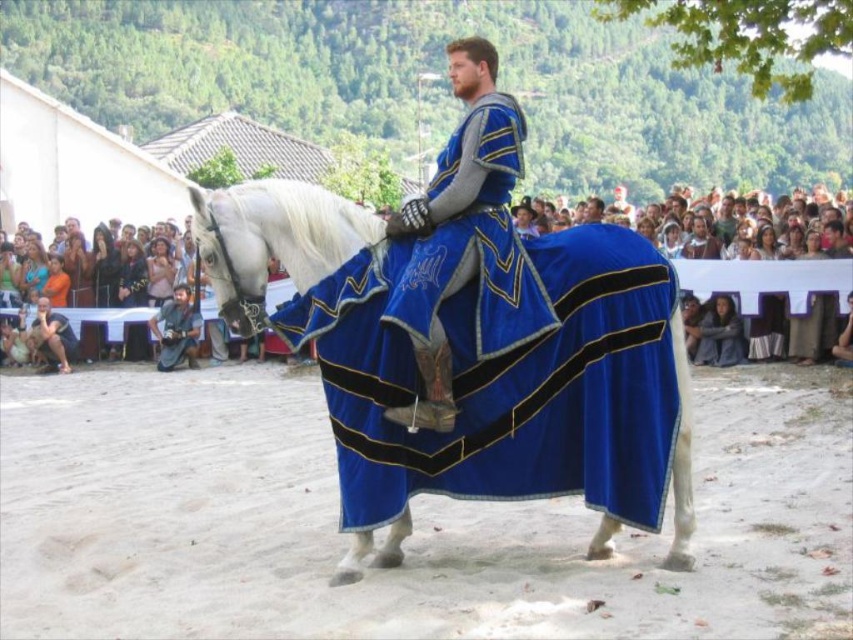
Based on the photo, you are a photographer at the medieval event. You want to capture both the blue velvet cape at center and the white glossy horse at center in a single frame. Given that your camera has a fixed focal length, which object should you position closer to the camera to ensure both fit in the frame?

Since the blue velvet cape at center is smaller than the white glossy horse at center, you should position the white glossy horse at center closer to the camera. This way, the larger object will take up more space in the frame, allowing both to fit without cropping either out.

You are a photographer at the medieval event. You want to capture a photo where the blue velvet cape at center is clearly visible without being blocked by the white glossy horse at center. Based on their positions, is this possible?

The blue velvet cape at center is above the white glossy horse at center, so it is positioned in a way that it won not be blocked by the horse. Therefore, the photographer can capture the cape clearly.

You are a photographer at the medieval event. You want to capture a closeup of the blue velvet cape at center. Where should you focus your camera lens?

You should focus your camera lens at point (467, 237) to capture a closeup of the blue velvet cape at center.